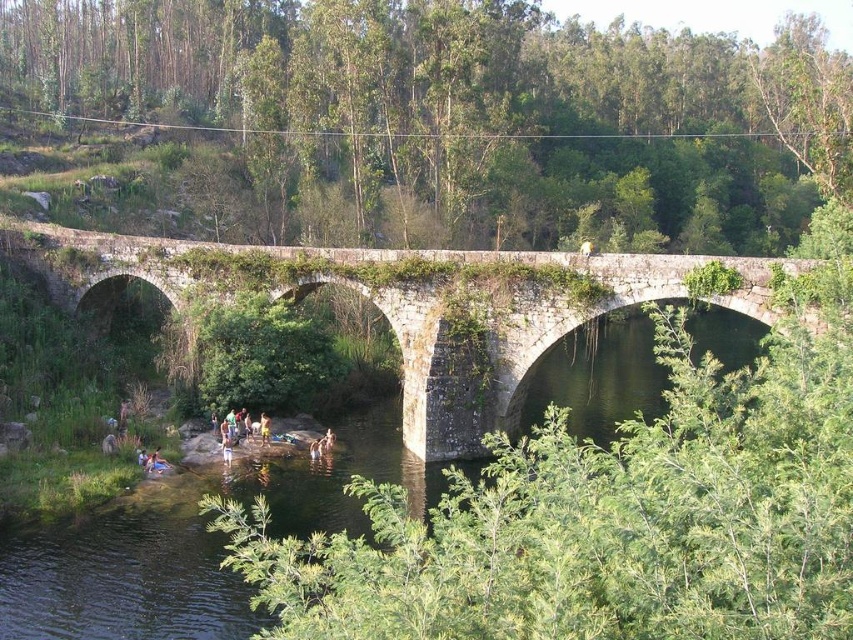
Is stone bridge at center smaller than light brown wooden stick at lower center?

Actually, stone bridge at center might be larger than light brown wooden stick at lower center.

Who is shorter, stone bridge at center or light brown wooden stick at lower center?

light brown wooden stick at lower center

What do you see at coordinates (412, 305) in the screenshot? I see `stone bridge at center` at bounding box center [412, 305].

Identify the location of stone bridge at center. The width and height of the screenshot is (853, 640). (412, 305).

Is light brown wooden stick at lower center positioned in front of yellow fabric shorts at lower center?

Yes, it is in front of yellow fabric shorts at lower center.

Does point (231, 442) lie behind point (265, 438)?

No, it is in front of (265, 438).

Find the location of a particular element. This screenshot has height=640, width=853. light brown wooden stick at lower center is located at coordinates (225, 445).

Does stone bridge at center have a greater width compared to yellow fabric shorts at lower center?

Correct, the width of stone bridge at center exceeds that of yellow fabric shorts at lower center.

Which is in front, point (506, 339) or point (262, 438)?

Point (506, 339)

Does point (219, 272) come in front of point (267, 442)?

No, (219, 272) is behind (267, 442).

This screenshot has height=640, width=853. What are the coordinates of `stone bridge at center` in the screenshot? It's located at (412, 305).